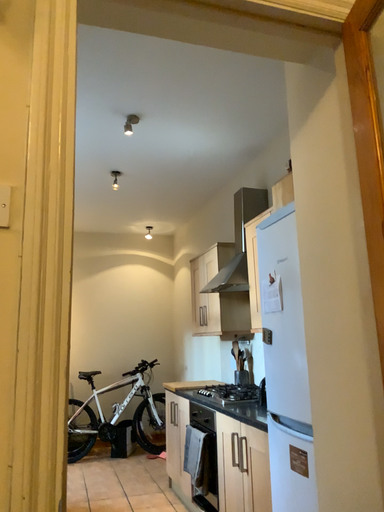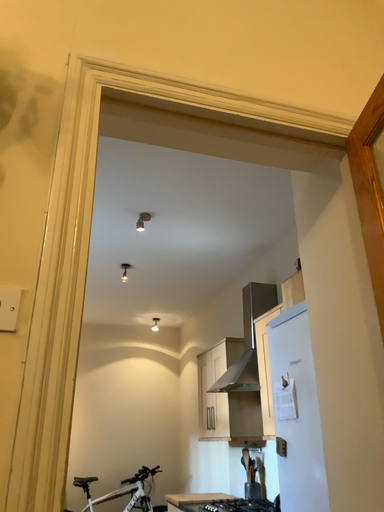
Question: Which way did the camera rotate in the video?

Choices:
 (A) rotated downward
 (B) rotated upward

Answer: (B)